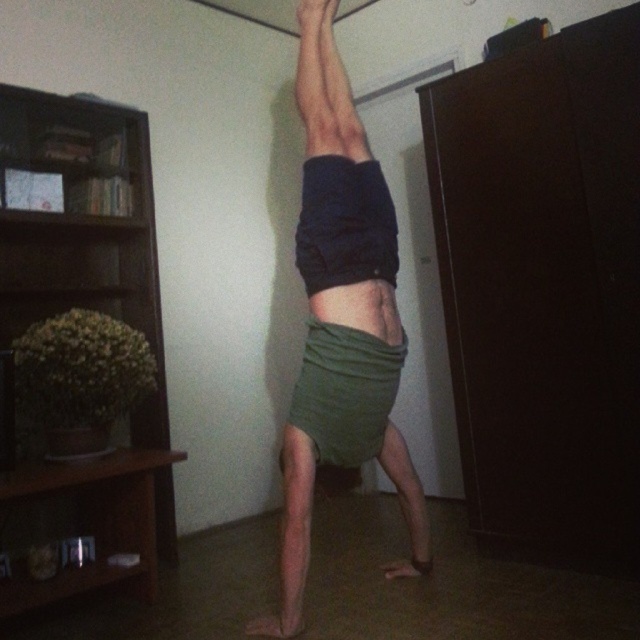
Does green fabric shorts at center have a lesser width compared to green fabric muscle at center?

No.

Which is behind, point (310, 161) or point (355, 291)?

Positioned behind is point (310, 161).

You are a GUI agent. You are given a task and a screenshot of the screen. Output one action in this format:
    pyautogui.click(x=<x>, y=<y>)
    Task: Click on the green fabric shorts at center
    
    Given the screenshot: What is the action you would take?
    click(x=340, y=317)

Does brown wooden bookshelf at left have a greater width compared to green fabric muscle at center?

Yes, brown wooden bookshelf at left is wider than green fabric muscle at center.

Where is `brown wooden bookshelf at left`? The width and height of the screenshot is (640, 640). brown wooden bookshelf at left is located at coordinates (81, 349).

Which is more to the left, brown wooden bookshelf at left or green fabric shorts at center?

From the viewer's perspective, brown wooden bookshelf at left appears more on the left side.

The image size is (640, 640). Describe the element at coordinates (81, 349) in the screenshot. I see `brown wooden bookshelf at left` at that location.

Find the location of a particular element. brown wooden bookshelf at left is located at coordinates (81, 349).

The height and width of the screenshot is (640, 640). I want to click on brown wooden bookshelf at left, so click(81, 349).